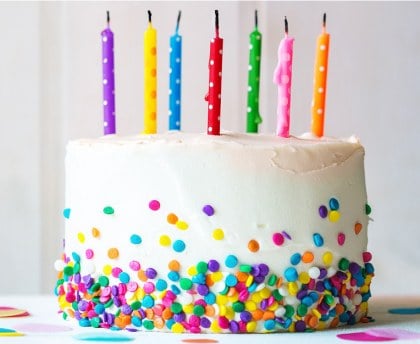
At what (x,y) coordinates should I click in order to perform the action: click on candle wicks. Please return your answer as a coordinate pair (x, y). This screenshot has height=344, width=420. Looking at the image, I should click on (106, 17), (151, 19), (178, 17), (216, 26), (256, 23), (286, 27), (325, 24).